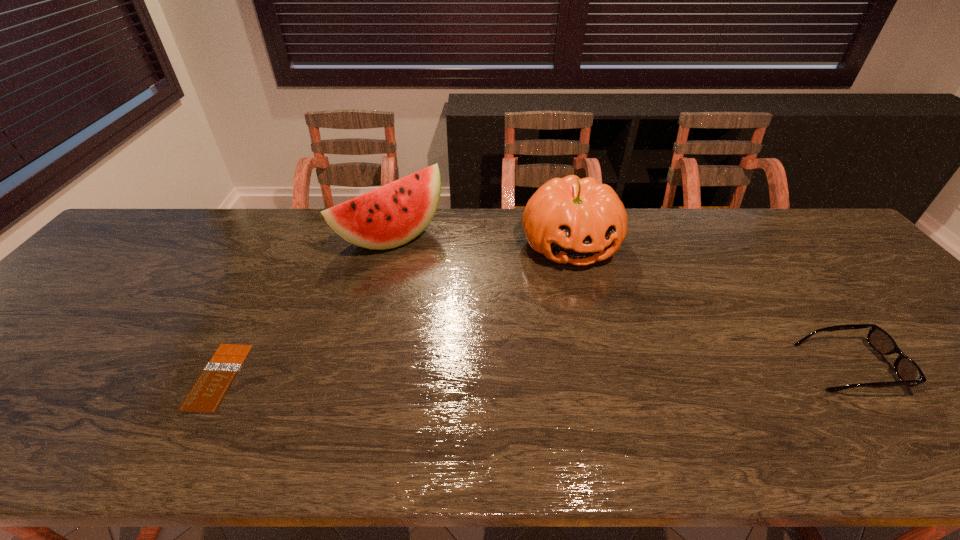
Identify the location of the shortest object. This screenshot has height=540, width=960. (206, 395).

Image resolution: width=960 pixels, height=540 pixels. What are the coordinates of `the leftmost object` in the screenshot? It's located at (206, 395).

The image size is (960, 540). Identify the location of the rightmost object. (909, 373).

This screenshot has height=540, width=960. What are the coordinates of `the second shortest object` in the screenshot? It's located at (909, 373).

Locate an element on the screen. Image resolution: width=960 pixels, height=540 pixels. watermelon is located at coordinates (392, 215).

Locate an element on the screen. This screenshot has height=540, width=960. the third object from left to right is located at coordinates (570, 220).

I want to click on vacant space situated on the right of the leftmost object, so click(x=413, y=376).

What are the coordinates of `vacant space situated on the lenses of the third tallest object` in the screenshot? It's located at (932, 367).

Where is `vacant position located on the outer rind of the second object from left to right`? vacant position located on the outer rind of the second object from left to right is located at coordinates (516, 334).

The image size is (960, 540). What are the coordinates of `vacant region located 0.310m on the outer rind of the second object from left to right` in the screenshot? It's located at (492, 313).